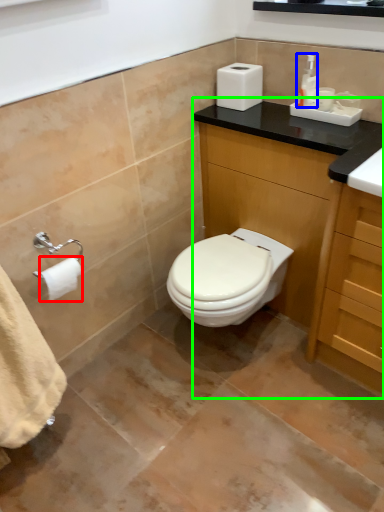
Question: Which is nearer to the toilet paper (highlighted by a red box)? toiletry (highlighted by a blue box) or bathroom cabinet (highlighted by a green box).

Choices:
 (A) toiletry
 (B) bathroom cabinet

Answer: (B)